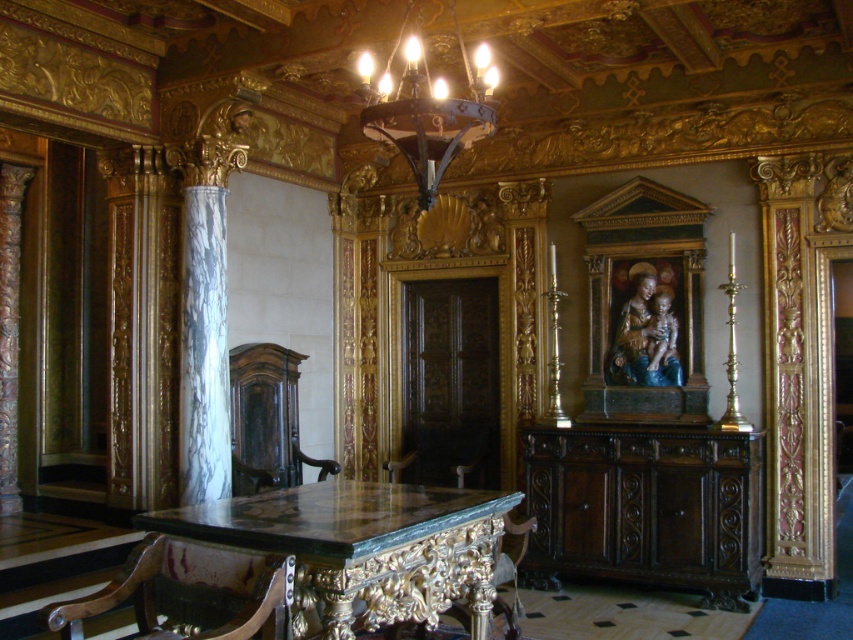
Question: Is green marble table at center wider than dark wood chair at left?

Choices:
 (A) yes
 (B) no

Answer: (A)

Question: Which object is the farthest from the green marble chair at lower center?

Choices:
 (A) green marble table at center
 (B) dark wood chair at left

Answer: (B)

Question: Which point is closer to the camera taking this photo?

Choices:
 (A) (233, 564)
 (B) (509, 566)
 (C) (436, 88)

Answer: (A)

Question: Can you confirm if dark bronze chandelier at upper center is bigger than green marble chair at lower center?

Choices:
 (A) no
 (B) yes

Answer: (A)

Question: Which object appears farthest from the camera in this image?

Choices:
 (A) dark wood chair at left
 (B) dark bronze chandelier at upper center

Answer: (A)

Question: Does green marble table at center have a greater width compared to dark wood chair at left?

Choices:
 (A) yes
 (B) no

Answer: (A)